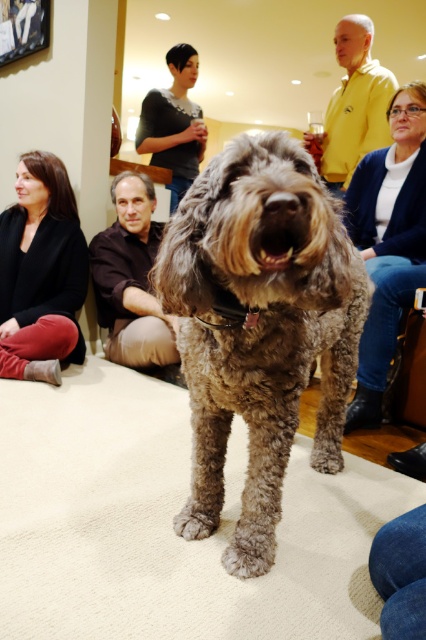
Who is lower down, denim jacket at lower right or yellow smooth shirt at upper center?

denim jacket at lower right

Between denim jacket at lower right and yellow smooth shirt at upper center, which one has less height?

yellow smooth shirt at upper center

Is point (351, 218) farther from viewer compared to point (365, 60)?

No, it is in front of (365, 60).

Identify the location of denim jacket at lower right. This screenshot has width=426, height=640. (388, 243).

Does brown leather jacket at lower center appear on the left side of faded denim jeans at lower right?

Correct, you'll find brown leather jacket at lower center to the left of faded denim jeans at lower right.

Can you confirm if brown leather jacket at lower center is positioned to the right of faded denim jeans at lower right?

Incorrect, brown leather jacket at lower center is not on the right side of faded denim jeans at lower right.

Which is behind, point (115, 262) or point (409, 524)?

Positioned behind is point (115, 262).

Image resolution: width=426 pixels, height=640 pixels. I want to click on brown leather jacket at lower center, so click(131, 278).

Between point (19, 333) and point (172, 115), which one is positioned in front?

Point (19, 333) is in front.

Is matte black jacket at lower left thinner than dark gray sweater at upper center?

Yes.

Between point (63, 257) and point (170, 52), which one is positioned behind?

The point (170, 52) is behind.

Identify the location of matte black jacket at lower left. This screenshot has height=640, width=426. tap(40, 262).